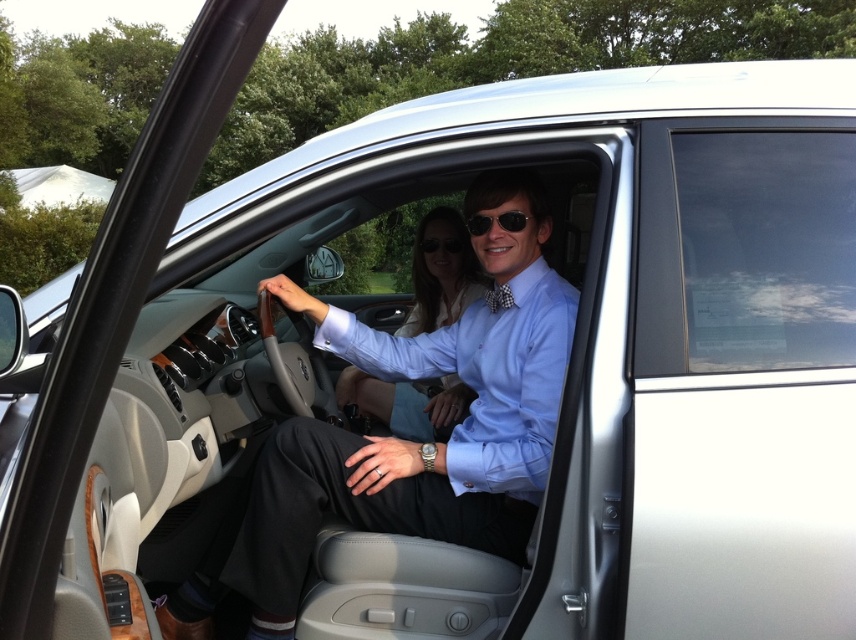
Question: Is light blue shirt at center smaller than light blue cotton dress shirt at center?

Choices:
 (A) yes
 (B) no

Answer: (B)

Question: Estimate the real-world distances between objects in this image. Which object is closer to the matte blue shirt at center?

Choices:
 (A) light blue shirt at center
 (B) black plastic sunglasses at center
 (C) light blue cotton dress shirt at center

Answer: (B)

Question: Is matte blue shirt at center below sunglasses at center?

Choices:
 (A) yes
 (B) no

Answer: (A)

Question: Which object appears closest to the camera in this image?

Choices:
 (A) sunglasses at center
 (B) matte blue shirt at center
 (C) light blue cotton dress shirt at center

Answer: (C)

Question: Can you confirm if matte blue shirt at center is smaller than sunglasses at center?

Choices:
 (A) yes
 (B) no

Answer: (B)

Question: Which of the following is the closest to the observer?

Choices:
 (A) (437, 240)
 (B) (565, 316)

Answer: (B)